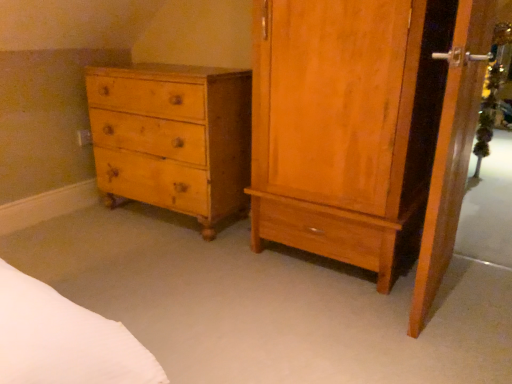
The image size is (512, 384). Identify the location of vacant space that is to the left of wooden screen door at right. (329, 311).